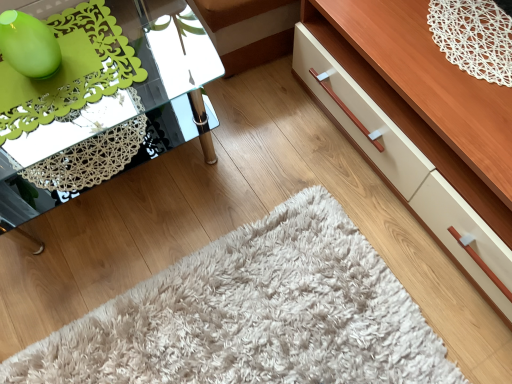
Question: Is wooden dresser at lower right facing away from clear glass table at left?

Choices:
 (A) no
 (B) yes

Answer: (A)

Question: From a real-world perspective, is wooden dresser at lower right under clear glass table at left?

Choices:
 (A) no
 (B) yes

Answer: (B)

Question: Is wooden dresser at lower right bigger than clear glass table at left?

Choices:
 (A) yes
 (B) no

Answer: (A)

Question: From the image's perspective, is wooden dresser at lower right above clear glass table at left?

Choices:
 (A) no
 (B) yes

Answer: (B)

Question: Does wooden dresser at lower right appear on the right side of clear glass table at left?

Choices:
 (A) yes
 (B) no

Answer: (A)

Question: Does wooden dresser at lower right have a lesser height compared to clear glass table at left?

Choices:
 (A) no
 (B) yes

Answer: (B)

Question: Is clear glass table at left smaller than wooden dresser at lower right?

Choices:
 (A) yes
 (B) no

Answer: (A)

Question: Can you confirm if clear glass table at left is taller than wooden dresser at lower right?

Choices:
 (A) no
 (B) yes

Answer: (B)

Question: Does clear glass table at left have a larger size compared to wooden dresser at lower right?

Choices:
 (A) no
 (B) yes

Answer: (A)

Question: Does clear glass table at left lie in front of wooden dresser at lower right?

Choices:
 (A) no
 (B) yes

Answer: (A)

Question: Could you tell me if clear glass table at left is turned towards wooden dresser at lower right?

Choices:
 (A) yes
 (B) no

Answer: (B)

Question: Considering the relative sizes of clear glass table at left and wooden dresser at lower right in the image provided, is clear glass table at left thinner than wooden dresser at lower right?

Choices:
 (A) no
 (B) yes

Answer: (B)

Question: Is clear glass table at left inside or outside of wooden dresser at lower right?

Choices:
 (A) outside
 (B) inside

Answer: (A)